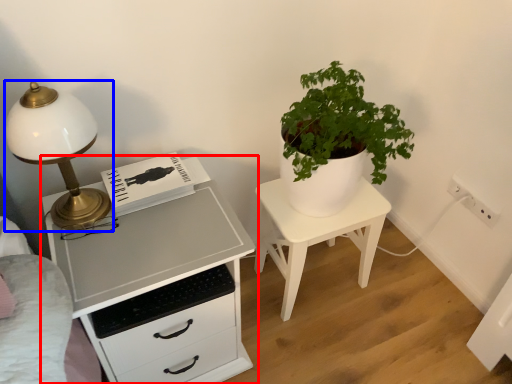
Question: Which point is closer to the camera, chest of drawers (highlighted by a red box) or lamp (highlighted by a blue box)?

Choices:
 (A) chest of drawers
 (B) lamp

Answer: (B)